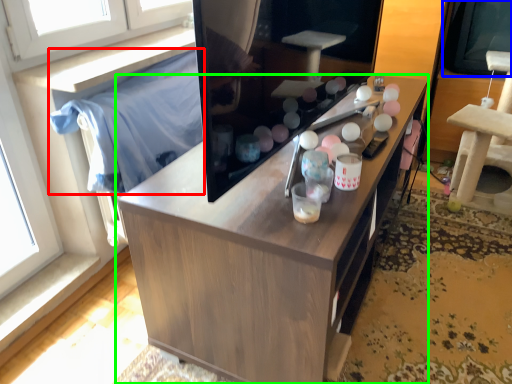
Question: Based on their relative distances, which object is farther from cloth (highlighted by a red box)? Choose from window screen (highlighted by a blue box) and cabinetry (highlighted by a green box).

Choices:
 (A) window screen
 (B) cabinetry

Answer: (A)